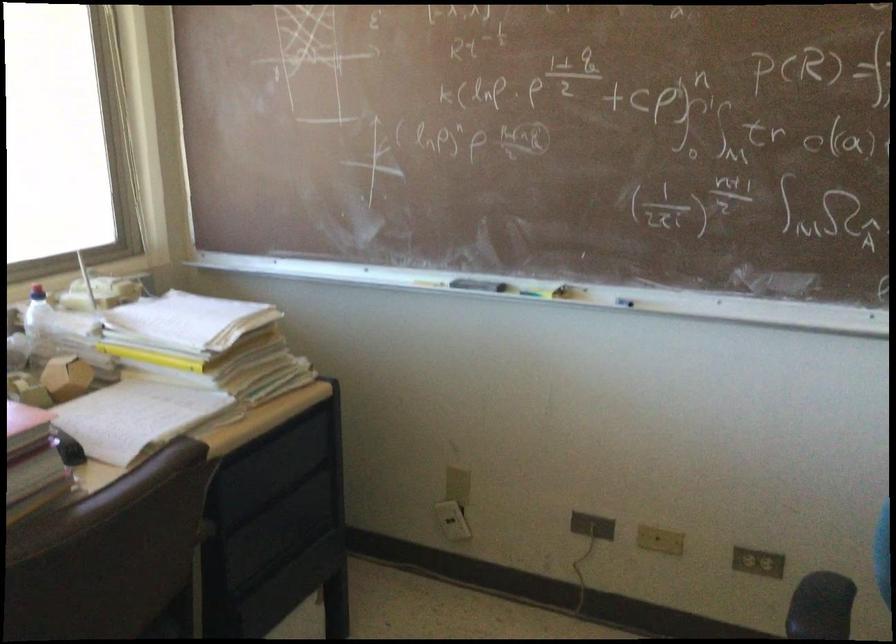
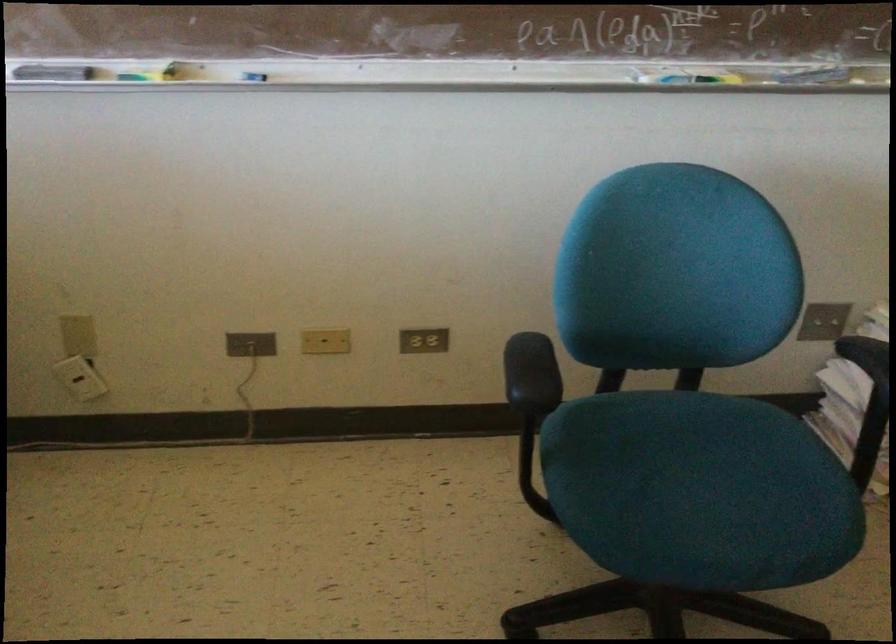
The first image is from the beginning of the video and the second image is from the end. How did the camera likely rotate when shooting the video?

The camera's rotation is toward right-down.